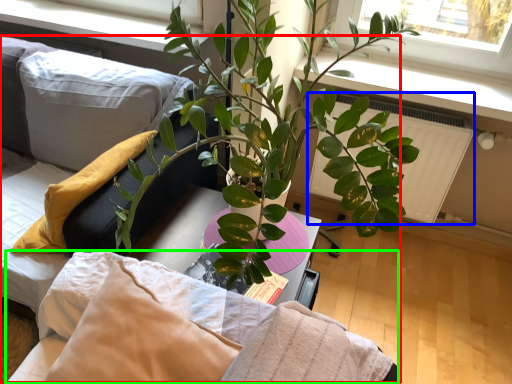
Question: Which object is positioned closest to bed (highlighted by a red box)? Select from radiator (highlighted by a blue box) and bedding (highlighted by a green box).

Choices:
 (A) radiator
 (B) bedding

Answer: (B)